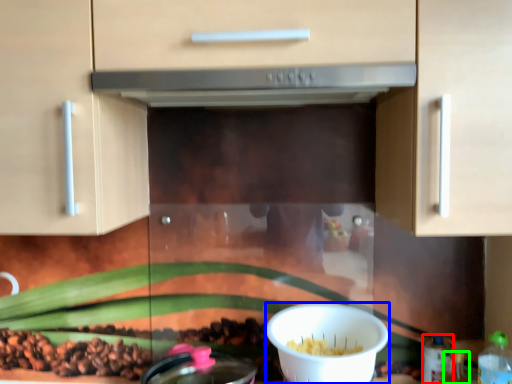
Question: Considering the real-world distances, which object is closest to bottle (highlighted by a red box)? bowl (highlighted by a blue box) or bottle (highlighted by a green box).

Choices:
 (A) bowl
 (B) bottle

Answer: (B)